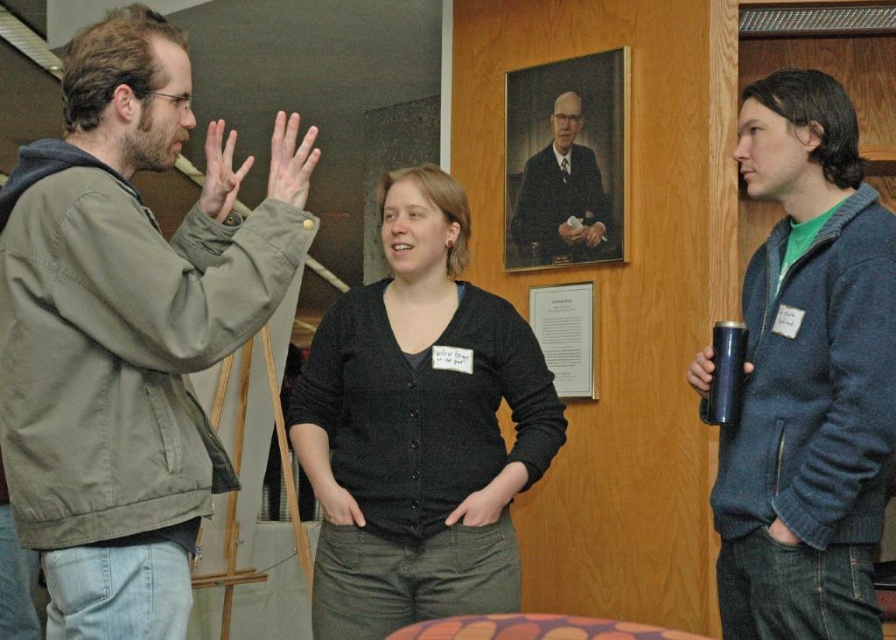
Question: Where is formal black suit at upper center located in relation to matte skin hand at upper center in the image?

Choices:
 (A) left
 (B) right

Answer: (B)

Question: Does dark gray sweater at center appear under matte gray hand at upper left?

Choices:
 (A) yes
 (B) no

Answer: (A)

Question: Which point is farther to the camera?

Choices:
 (A) 209,205
 (B) 334,493
 (C) 584,172
 (D) 780,300

Answer: (C)

Question: Among these objects, which one is farthest from the camera?

Choices:
 (A) matte khaki jacket at left
 (B) formal black suit at upper center

Answer: (B)

Question: Which is farther from the matte gray hand at upper left?

Choices:
 (A) matte skin hand at upper center
 (B) blue fleece jacket at right
 (C) matte khaki jacket at left

Answer: (B)

Question: Is matte khaki jacket at left above matte gray hand at upper left?

Choices:
 (A) yes
 (B) no

Answer: (B)